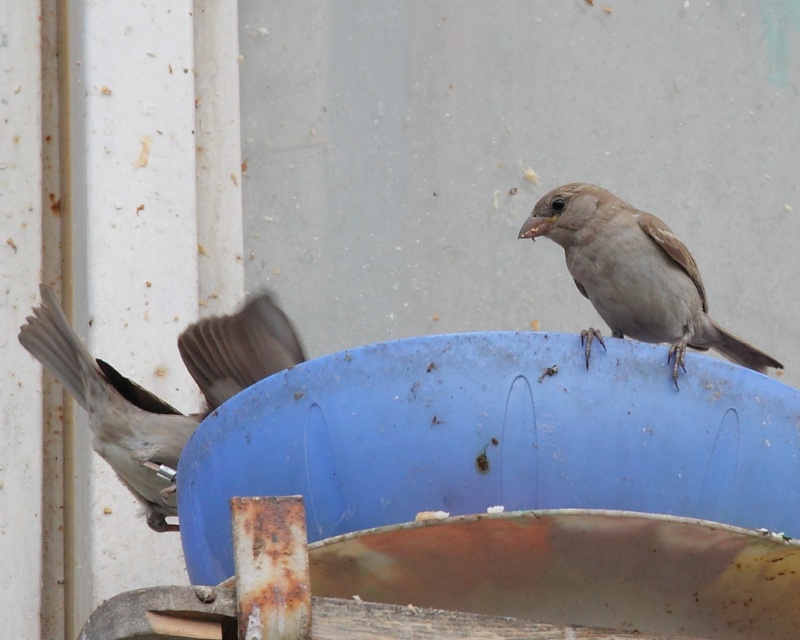
Question: Does gray matte sparrow at left appear under gray matte sparrow at upper right?

Choices:
 (A) no
 (B) yes

Answer: (B)

Question: Where is gray matte sparrow at left located in relation to gray matte sparrow at upper right in the image?

Choices:
 (A) above
 (B) below

Answer: (B)

Question: Which point is farther from the camera taking this photo?

Choices:
 (A) (202, 346)
 (B) (664, 305)

Answer: (B)

Question: Which point appears farthest from the camera in this image?

Choices:
 (A) (712, 332)
 (B) (158, 433)

Answer: (B)

Question: Is gray matte sparrow at left in front of gray matte sparrow at upper right?

Choices:
 (A) yes
 (B) no

Answer: (A)